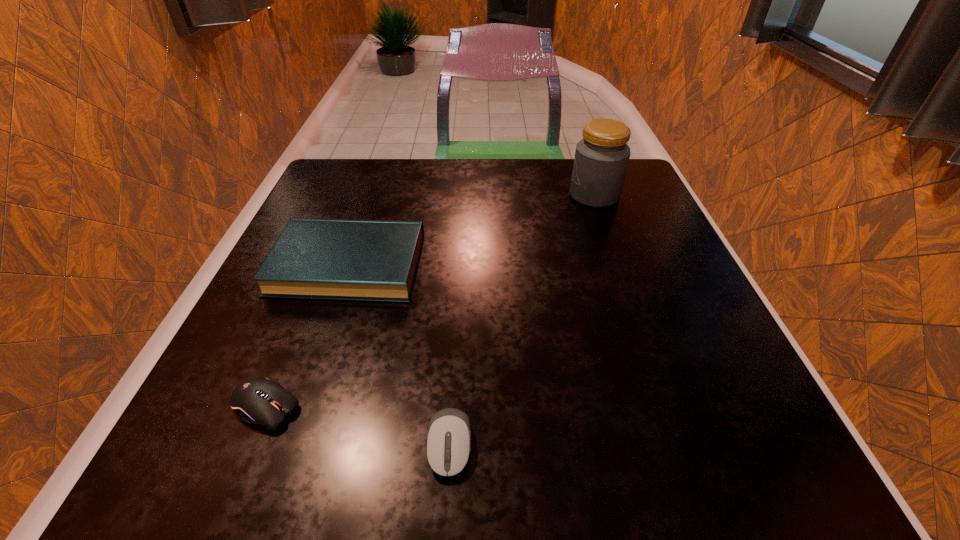
Locate an element on the screen. The height and width of the screenshot is (540, 960). object located in the far edge section of the desktop is located at coordinates (601, 159).

Identify the location of book positioned at the left edge. This screenshot has height=540, width=960. (333, 259).

This screenshot has width=960, height=540. Find the location of `computer mouse present at the left edge`. computer mouse present at the left edge is located at coordinates (258, 400).

The height and width of the screenshot is (540, 960). Identify the location of object located at the right edge. (601, 159).

The width and height of the screenshot is (960, 540). Find the location of `object present at the near left corner`. object present at the near left corner is located at coordinates (258, 400).

Identify the location of object positioned at the far right corner. (601, 159).

Where is `free space at the far edge of the desktop`? This screenshot has width=960, height=540. free space at the far edge of the desktop is located at coordinates (x=501, y=198).

The image size is (960, 540). Find the location of `free region at the near edge`. free region at the near edge is located at coordinates (650, 457).

At what (x,y) coordinates should I click in order to perform the action: click on blank space at the left edge of the desktop. Please return your answer as a coordinate pair (x, y). Image resolution: width=960 pixels, height=540 pixels. Looking at the image, I should click on (313, 334).

At what (x,y) coordinates should I click in order to perform the action: click on vacant region at the right edge. Please return your answer as a coordinate pair (x, y). The image size is (960, 540). Looking at the image, I should click on (592, 212).